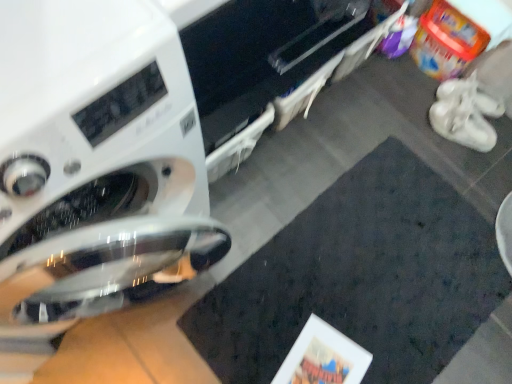
Question: Is white matte shoe at right not inside dark matte mat at center?

Choices:
 (A) no
 (B) yes

Answer: (B)

Question: Is white matte shoe at right positioned behind dark matte mat at center?

Choices:
 (A) no
 (B) yes

Answer: (B)

Question: Is dark matte mat at center inside white matte shoe at right?

Choices:
 (A) yes
 (B) no

Answer: (B)

Question: Is white matte shoe at right at the left side of dark matte mat at center?

Choices:
 (A) yes
 (B) no

Answer: (B)

Question: Does white matte shoe at right have a larger size compared to dark matte mat at center?

Choices:
 (A) no
 (B) yes

Answer: (A)

Question: From a real-world perspective, is dark matte mat at center positioned above or below white matte shoe at right?

Choices:
 (A) above
 (B) below

Answer: (B)

Question: Looking at their shapes, would you say dark matte mat at center is wider or thinner than white matte shoe at right?

Choices:
 (A) wide
 (B) thin

Answer: (A)

Question: Does point (384, 326) appear closer or farther from the camera than point (455, 79)?

Choices:
 (A) closer
 (B) farther

Answer: (A)

Question: In the image, is dark matte mat at center on the left side or the right side of white matte shoe at right?

Choices:
 (A) right
 (B) left

Answer: (B)

Question: Considering the positions of white suede sneakers at right and white matte shoe at right in the image, is white suede sneakers at right bigger or smaller than white matte shoe at right?

Choices:
 (A) small
 (B) big

Answer: (B)

Question: Considering the positions of white suede sneakers at right and white matte shoe at right in the image, is white suede sneakers at right taller or shorter than white matte shoe at right?

Choices:
 (A) short
 (B) tall

Answer: (B)

Question: Relative to white matte shoe at right, is white suede sneakers at right in front or behind?

Choices:
 (A) front
 (B) behind

Answer: (A)

Question: From the image's perspective, is white suede sneakers at right positioned above or below white matte shoe at right?

Choices:
 (A) above
 (B) below

Answer: (B)

Question: Looking at the image, does white glossy washing machine at left seem bigger or smaller compared to white suede sneakers at right?

Choices:
 (A) big
 (B) small

Answer: (A)

Question: Do you think white glossy washing machine at left is within white suede sneakers at right, or outside of it?

Choices:
 (A) outside
 (B) inside

Answer: (A)